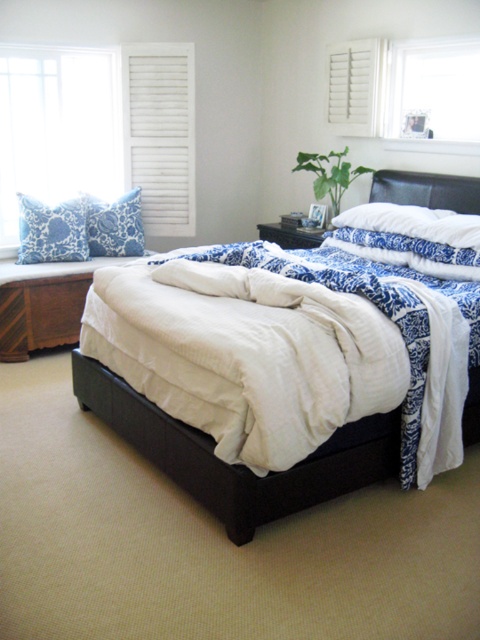
Question: Does white wooden shutter at upper center appear on the right side of blue printed fabric pillow at upper left?

Choices:
 (A) no
 (B) yes

Answer: (B)

Question: Where is white wooden window at upper right located in relation to wooden dresser at lower left in the image?

Choices:
 (A) above
 (B) below

Answer: (A)

Question: Can you confirm if matte black bed at center is wider than blue printed pillow at upper left?

Choices:
 (A) no
 (B) yes

Answer: (B)

Question: Based on their relative distances, which object is farther from the blue printed fabric pillow at upper left?

Choices:
 (A) blue printed pillow at upper left
 (B) white wood shutters at upper left
 (C) black leather headboard at center
 (D) white soft pillow at center

Answer: (C)

Question: Considering the real-world distances, which object is farthest from the white wood shutter at upper left?

Choices:
 (A) white wooden window at upper right
 (B) white wood shutters at upper left

Answer: (A)

Question: Which object is farther from the camera taking this photo?

Choices:
 (A) matte black bed at center
 (B) white wood shutter at upper left

Answer: (B)